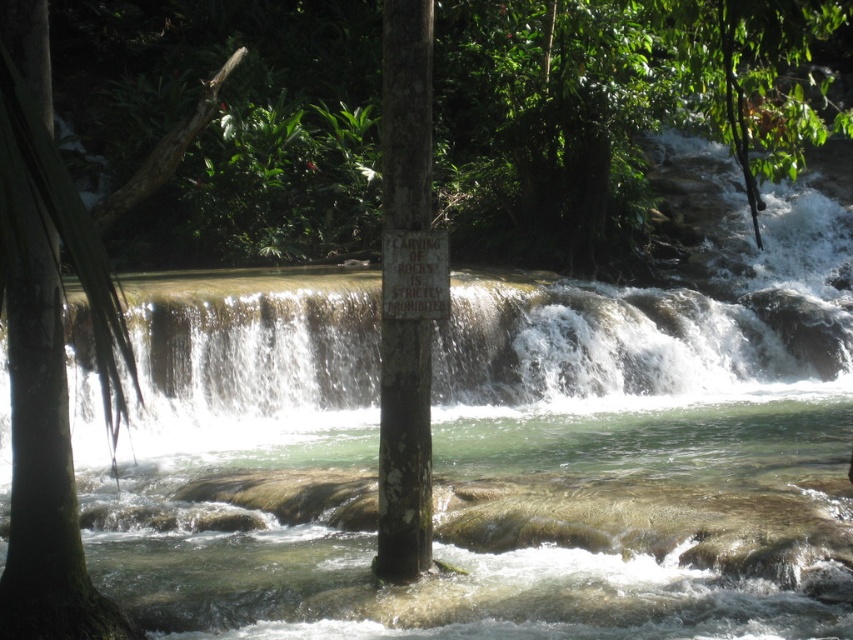
You are a nature photographer planning to capture the translucent white water at center and the green rough bark tree at left in a single shot. Based on their sizes, which object would dominate the frame more?

The translucent white water at center is bigger than the green rough bark tree at left, so it would dominate the frame more.